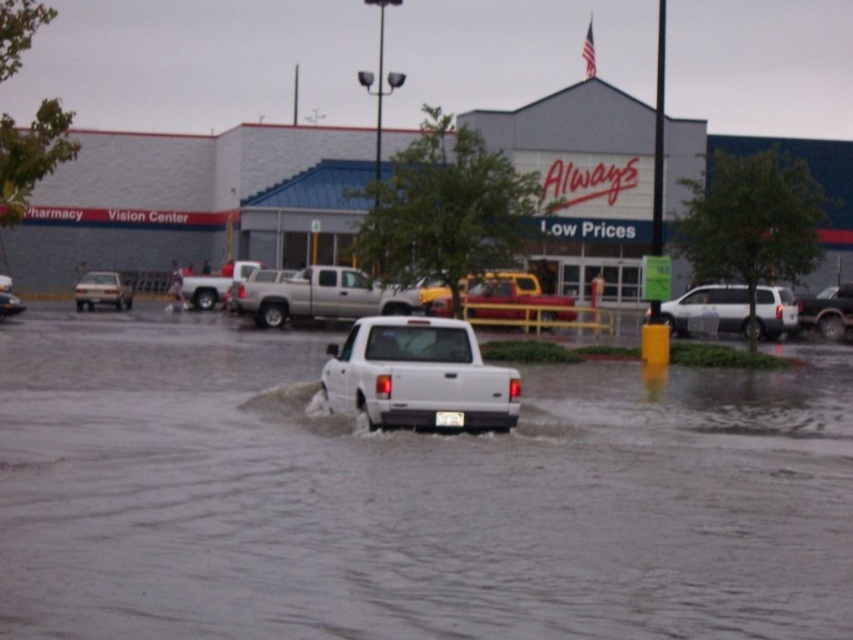
Question: Which point is farther to the camera?

Choices:
 (A) (343, 312)
 (B) (97, 292)

Answer: (B)

Question: Can you confirm if gray brick mall at center is thinner than silver metallic pickup truck at center?

Choices:
 (A) yes
 (B) no

Answer: (B)

Question: Among these objects, which one is farthest from the camera?

Choices:
 (A) white matte truck at left
 (B) white matte truck at center
 (C) silver metallic pickup truck at center
 (D) matte white suv at center

Answer: (A)

Question: Does white matte truck at center appear on the right side of white matte truck at left?

Choices:
 (A) yes
 (B) no

Answer: (A)

Question: Is white matte suv at center positioned at the back of matte white suv at center?

Choices:
 (A) yes
 (B) no

Answer: (B)

Question: Which object is the farthest from the white matte suv at center?

Choices:
 (A) matte white suv at center
 (B) white matte truck at left

Answer: (B)